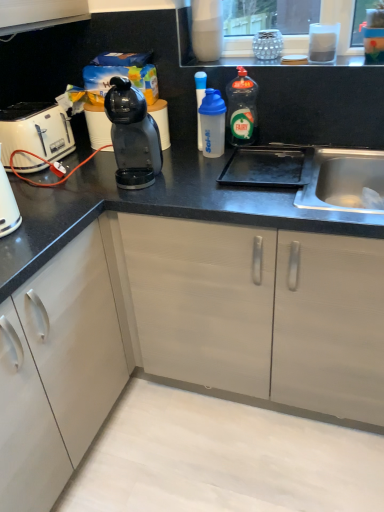
Question: Is black plastic coffee machine at center shorter than transparent plastic shaker at center, marked as the 3th bottle in a right-to-left arrangement?

Choices:
 (A) yes
 (B) no

Answer: (B)

Question: Can you confirm if black plastic coffee machine at center is positioned to the right of transparent plastic shaker at center, marked as the 3th bottle in a right-to-left arrangement?

Choices:
 (A) yes
 (B) no

Answer: (B)

Question: Considering the relative positions of black plastic coffee machine at center and transparent plastic shaker at center, marked as the 3th bottle in a right-to-left arrangement, in the image provided, is black plastic coffee machine at center to the left of transparent plastic shaker at center, marked as the 3th bottle in a right-to-left arrangement, from the viewer's perspective?

Choices:
 (A) no
 (B) yes

Answer: (B)

Question: Does black plastic coffee machine at center contain transparent plastic shaker at center, which is the first bottle in left-to-right order?

Choices:
 (A) no
 (B) yes

Answer: (A)

Question: From the image's perspective, is black plastic coffee machine at center on top of transparent plastic shaker at center, which is the first bottle in left-to-right order?

Choices:
 (A) yes
 (B) no

Answer: (B)

Question: From a real-world perspective, is black plastic coffee machine at center on transparent plastic shaker at center, marked as the 3th bottle in a right-to-left arrangement?

Choices:
 (A) yes
 (B) no

Answer: (A)

Question: Does white plastic toaster at left have a smaller size compared to transparent plastic shaker at center, which is the first bottle in left-to-right order?

Choices:
 (A) no
 (B) yes

Answer: (A)

Question: Can you confirm if white plastic toaster at left is shorter than transparent plastic shaker at center, marked as the 3th bottle in a right-to-left arrangement?

Choices:
 (A) no
 (B) yes

Answer: (B)

Question: Is white plastic toaster at left wider than transparent plastic shaker at center, marked as the 3th bottle in a right-to-left arrangement?

Choices:
 (A) yes
 (B) no

Answer: (A)

Question: From the image's perspective, is white plastic toaster at left located beneath transparent plastic shaker at center, which is the first bottle in left-to-right order?

Choices:
 (A) yes
 (B) no

Answer: (A)

Question: Is white plastic toaster at left facing towards transparent plastic shaker at center, marked as the 3th bottle in a right-to-left arrangement?

Choices:
 (A) no
 (B) yes

Answer: (B)

Question: Can you confirm if white plastic toaster at left is taller than transparent plastic shaker at center, marked as the 3th bottle in a right-to-left arrangement?

Choices:
 (A) yes
 (B) no

Answer: (B)

Question: Considering the relative sizes of white plastic shaker at center, which is counted as the second bottle, starting from the left, and transparent plastic bottle at center, which is the third bottle in left-to-right order, in the image provided, is white plastic shaker at center, which is counted as the second bottle, starting from the left, shorter than transparent plastic bottle at center, which is the third bottle in left-to-right order,?

Choices:
 (A) yes
 (B) no

Answer: (A)